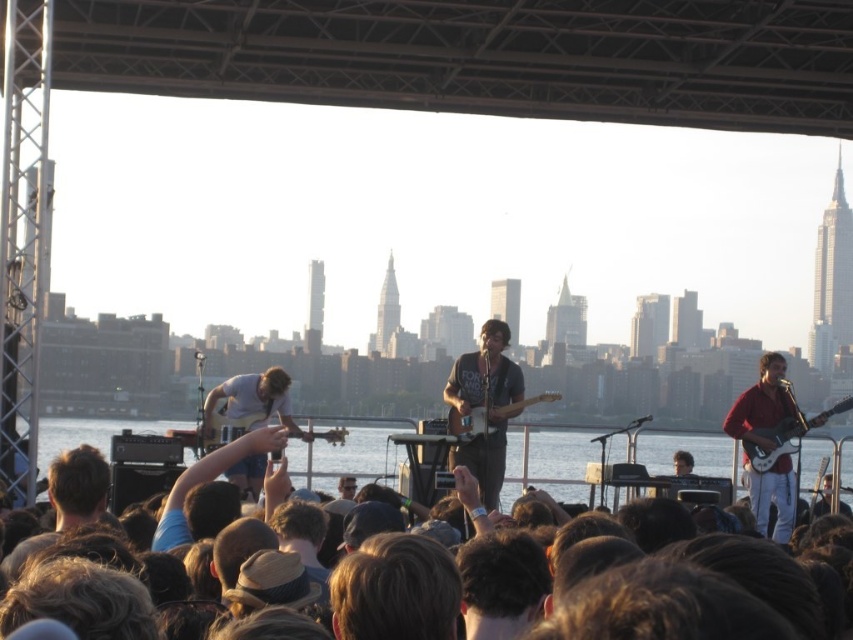
Can you confirm if matte black guitar at center is smaller than light brown leather hat at center?

Incorrect, matte black guitar at center is not smaller in size than light brown leather hat at center.

Can you confirm if matte black guitar at center is taller than light brown leather hat at center?

Yes.

Is point (497, 477) less distant than point (347, 484)?

That is True.

Identify the location of matte black guitar at center. The image size is (853, 640). (485, 404).

Which of these two, matte black guitar at center or shiny red guitar at right, stands taller?

With more height is shiny red guitar at right.

Does matte black guitar at center lie behind shiny red guitar at right?

No.

The height and width of the screenshot is (640, 853). What do you see at coordinates (485, 404) in the screenshot?
I see `matte black guitar at center` at bounding box center [485, 404].

Identify the location of matte black guitar at center. (485, 404).

Does brown hair at lower center have a larger size compared to white glossy electric guitar at right?

Correct, brown hair at lower center is larger in size than white glossy electric guitar at right.

Identify the location of brown hair at lower center. (560, 451).